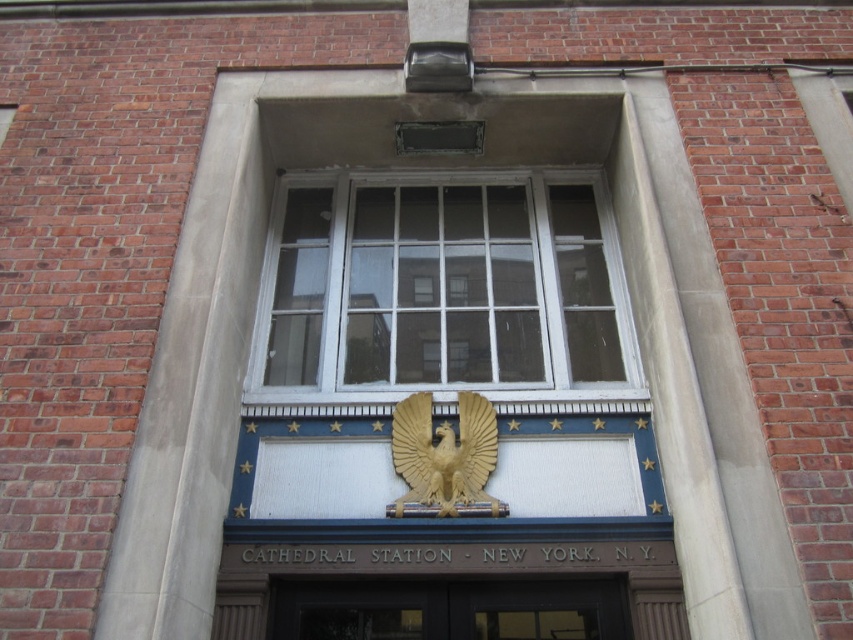
Measure the distance from white wood window at center to matte black door at center.

white wood window at center is 6.66 feet from matte black door at center.

Does white wood window at center have a smaller size compared to matte black door at center?

Actually, white wood window at center might be larger than matte black door at center.

Describe the element at coordinates (444, 289) in the screenshot. This screenshot has width=853, height=640. I see `white wood window at center` at that location.

Where is `white wood window at center`? Image resolution: width=853 pixels, height=640 pixels. white wood window at center is located at coordinates (444, 289).